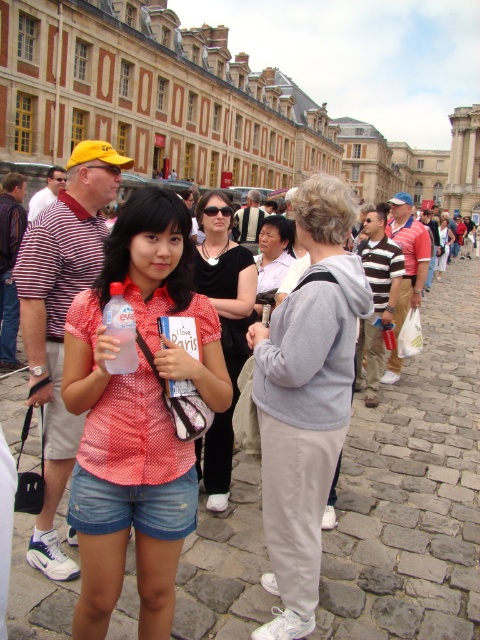
You are a fashion designer observing two shirts at a Parisian street scene. The polka dot fabric shirt at center and the matte black shirt at center. Which shirt has a larger size?

The polka dot fabric shirt at center is larger in size than the matte black shirt at center.

You are a photographer trying to capture the perfect shot of the two points in the image. Which point, point 1 at coordinates (300, 300) or point 2 at coordinates (120, 317), is closer to the camera?

Point 1 at coordinates (300, 300) is closer to the camera than point 2 at coordinates (120, 317).

You are a photographer trying to capture the scene in the image. You notice a matte black shirt at center located at point (223, 330). Where should you position your camera to ensure the matte black shirt at center is in the center of your photo?

To center the matte black shirt at center in your photo, position your camera so that the crosshairs align precisely with the coordinates (223, 330) where the matte black shirt at center is located.